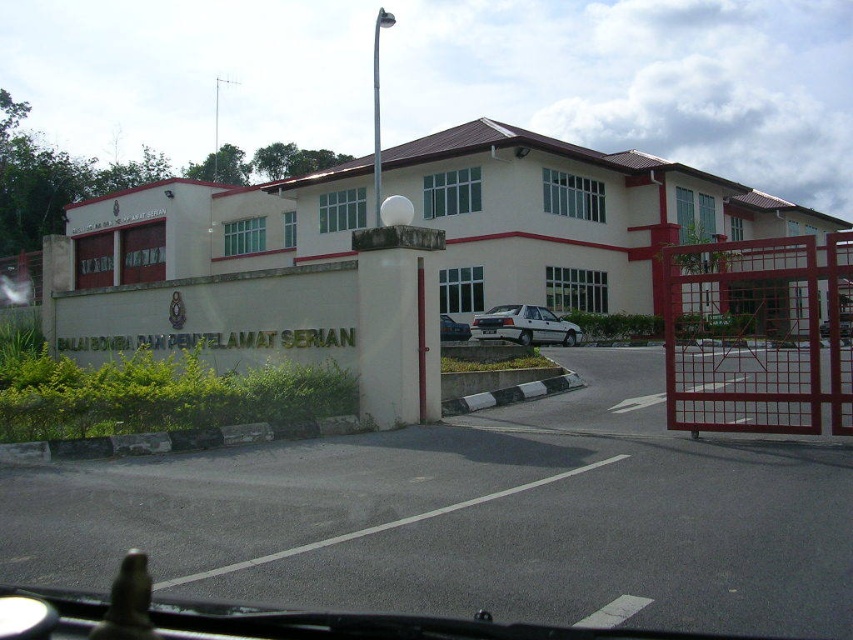
Question: Can you confirm if white matte sedan at center is positioned to the right of silver metallic sedan at center?

Choices:
 (A) yes
 (B) no

Answer: (A)

Question: Which of the following is the closest to the observer?

Choices:
 (A) (445, 339)
 (B) (601, 474)
 (C) (543, 337)

Answer: (B)

Question: Is asphalt pavement at center thinner than silver metallic sedan at center?

Choices:
 (A) yes
 (B) no

Answer: (B)

Question: Which point appears closest to the camera in this image?

Choices:
 (A) (538, 308)
 (B) (450, 333)
 (C) (18, 573)

Answer: (C)

Question: Among these objects, which one is farthest from the camera?

Choices:
 (A) white matte sedan at center
 (B) silver metallic sedan at center
 (C) asphalt pavement at center

Answer: (A)

Question: Is white matte sedan at center bigger than silver metallic sedan at center?

Choices:
 (A) yes
 (B) no

Answer: (B)